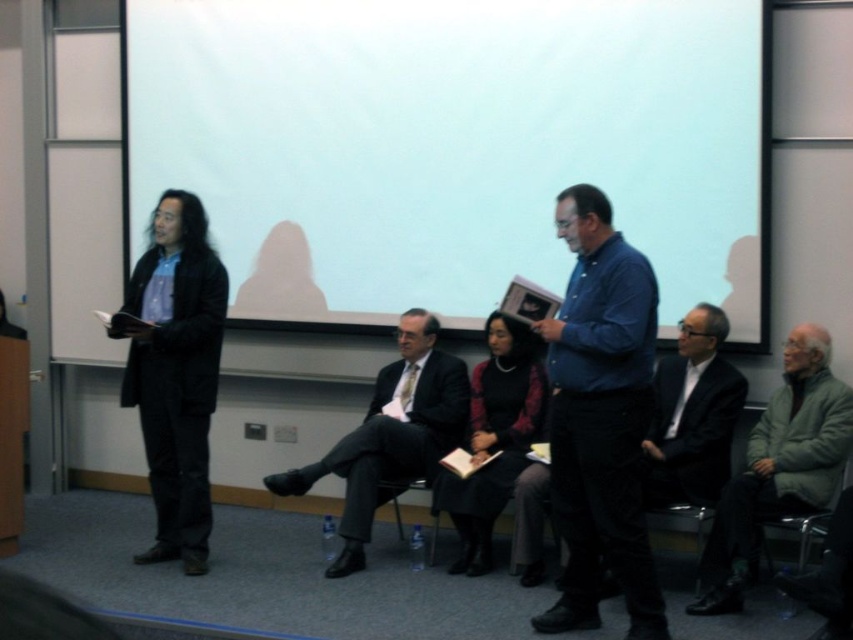
Between blue denim shirt at center and dark gray plastic chair at lower right, which one appears on the right side from the viewer's perspective?

dark gray plastic chair at lower right is more to the right.

In the scene shown: Does blue denim shirt at center appear on the left side of dark gray plastic chair at lower right?

Correct, you'll find blue denim shirt at center to the left of dark gray plastic chair at lower right.

The image size is (853, 640). What are the coordinates of `blue denim shirt at center` in the screenshot? It's located at (601, 417).

Is white matte projection screen at upper center closer to the viewer compared to dark red knit sweater at center?

That is False.

Which is above, white matte projection screen at upper center or dark red knit sweater at center?

white matte projection screen at upper center

Image resolution: width=853 pixels, height=640 pixels. Identify the location of white matte projection screen at upper center. (456, 147).

Between point (407, 436) and point (511, 324), which one is positioned behind?

Point (511, 324)

Does dark suit at center have a lesser height compared to dark red knit sweater at center?

In fact, dark suit at center may be taller than dark red knit sweater at center.

Locate an element on the screen. dark suit at center is located at coordinates (390, 435).

At what (x,y) coordinates should I click in order to perform the action: click on dark suit at center. Please return your answer as a coordinate pair (x, y). The width and height of the screenshot is (853, 640). Looking at the image, I should click on (390, 435).